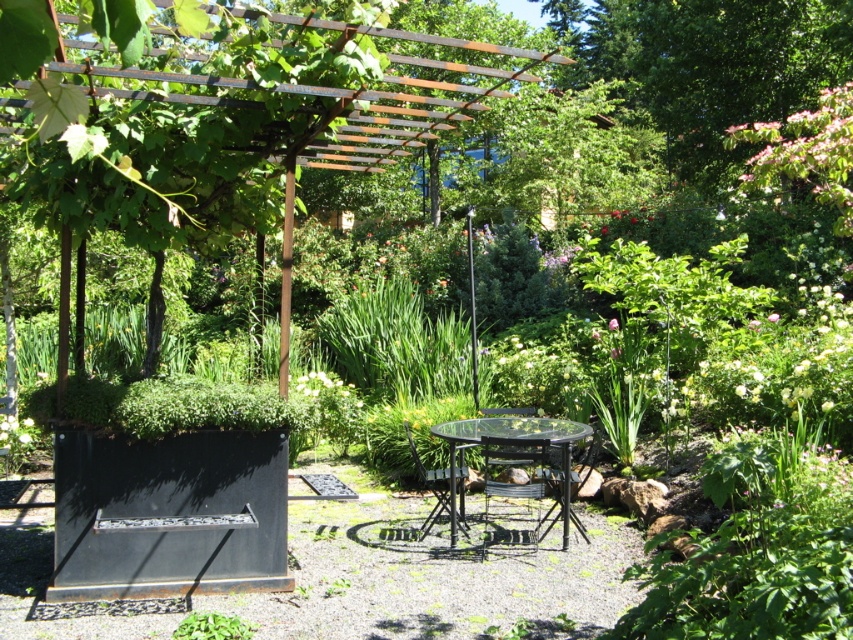
Does metallic black chair at center appear on the left side of black metal chair at center?

In fact, metallic black chair at center is to the right of black metal chair at center.

Is metallic black chair at center further to the viewer compared to black metal chair at center?

No, it is not.

Does point (486, 458) come farther from viewer compared to point (463, 444)?

No, (486, 458) is in front of (463, 444).

Locate an element on the screen. metallic black chair at center is located at coordinates (511, 467).

Which is below, transparent glass table at center or black metal chair at center?

black metal chair at center is below.

Measure the distance from transparent glass table at center to black metal chair at center.

They are 15.87 inches apart.

Where is `transparent glass table at center`? The image size is (853, 640). transparent glass table at center is located at coordinates (512, 436).

Which of these two, transparent glass table at center or metallic black chair at center, stands taller?

Standing taller between the two is transparent glass table at center.

Does transparent glass table at center have a lesser width compared to metallic black chair at center?

In fact, transparent glass table at center might be wider than metallic black chair at center.

What do you see at coordinates (512, 436) in the screenshot?
I see `transparent glass table at center` at bounding box center [512, 436].

Image resolution: width=853 pixels, height=640 pixels. What are the coordinates of `transparent glass table at center` in the screenshot? It's located at tap(512, 436).